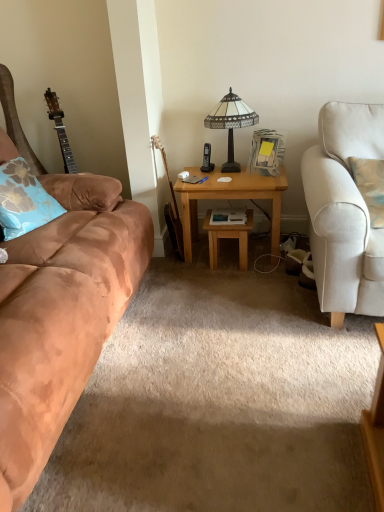
Question: Is wooden acoustic guitar at center taller than blue floral pillow at left?

Choices:
 (A) no
 (B) yes

Answer: (B)

Question: Does wooden acoustic guitar at center appear on the right side of blue floral pillow at left?

Choices:
 (A) yes
 (B) no

Answer: (A)

Question: Is wooden acoustic guitar at center completely or partially outside of blue floral pillow at left?

Choices:
 (A) no
 (B) yes

Answer: (B)

Question: From the image's perspective, does wooden acoustic guitar at center appear higher than blue floral pillow at left?

Choices:
 (A) no
 (B) yes

Answer: (B)

Question: Is wooden acoustic guitar at center touching blue floral pillow at left?

Choices:
 (A) no
 (B) yes

Answer: (A)

Question: Is wooden desk at center taller or shorter than blue floral pillow at left?

Choices:
 (A) tall
 (B) short

Answer: (A)

Question: Considering their positions, is wooden desk at center located in front of or behind blue floral pillow at left?

Choices:
 (A) front
 (B) behind

Answer: (B)

Question: Would you say wooden desk at center is to the left or to the right of blue floral pillow at left in the picture?

Choices:
 (A) right
 (B) left

Answer: (A)

Question: Is point (231, 179) closer or farther from the camera than point (18, 173)?

Choices:
 (A) farther
 (B) closer

Answer: (A)

Question: In terms of width, does stained glass lamp at center look wider or thinner when compared to blue floral pillow at left?

Choices:
 (A) thin
 (B) wide

Answer: (A)

Question: Looking at the image, does stained glass lamp at center seem bigger or smaller compared to blue floral pillow at left?

Choices:
 (A) big
 (B) small

Answer: (B)

Question: From the image's perspective, is stained glass lamp at center positioned above or below blue floral pillow at left?

Choices:
 (A) above
 (B) below

Answer: (A)

Question: Is point (215, 125) positioned closer to the camera than point (34, 206)?

Choices:
 (A) closer
 (B) farther

Answer: (B)

Question: Considering the positions of wooden desk at center and wooden acoustic guitar at center in the image, is wooden desk at center bigger or smaller than wooden acoustic guitar at center?

Choices:
 (A) big
 (B) small

Answer: (A)

Question: Choose the correct answer: Is wooden desk at center inside wooden acoustic guitar at center or outside it?

Choices:
 (A) inside
 (B) outside

Answer: (B)